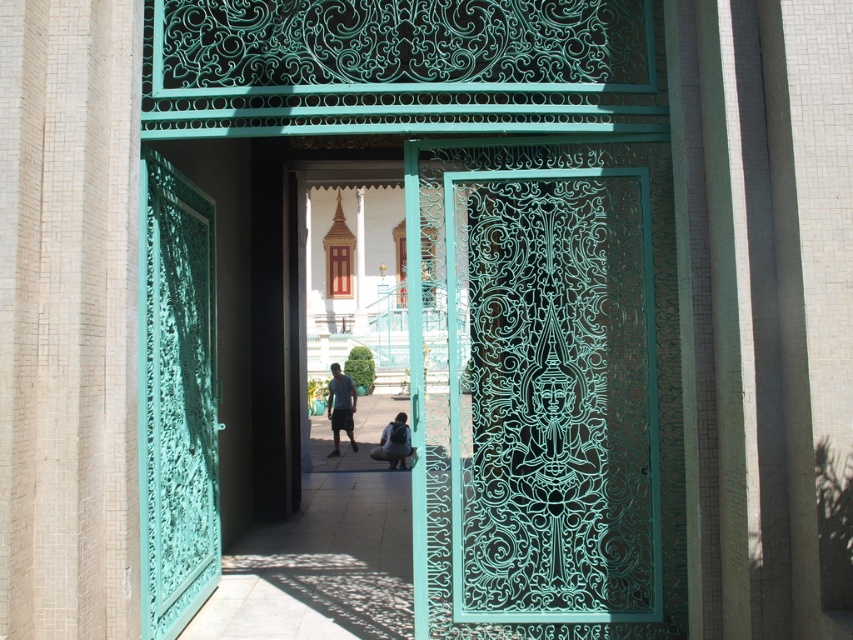
Who is shorter, green carved door at center or dark blue t-shirt at center?

dark blue t-shirt at center is shorter.

Which is below, green carved door at center or dark blue t-shirt at center?

Positioned lower is dark blue t-shirt at center.

You are a GUI agent. You are given a task and a screenshot of the screen. Output one action in this format:
    pyautogui.click(x=<x>, y=<y>)
    Task: Click on the green carved door at center
    
    Given the screenshot: What is the action you would take?
    pyautogui.click(x=538, y=388)

Image resolution: width=853 pixels, height=640 pixels. In order to click on green carved door at center in this screenshot , I will do `click(538, 388)`.

Between green carved door at center and matte black backpack at center, which one has more height?

green carved door at center

Does green carved door at center have a greater height compared to matte black backpack at center?

Correct, green carved door at center is much taller as matte black backpack at center.

Measure the distance between green carved door at center and camera.

They are 14.52 feet apart.

Find the location of a particular element. green carved door at center is located at coordinates (538, 388).

How far apart are dark blue t-shirt at center and matte black backpack at center?

2.64 meters

Which is more to the left, dark blue t-shirt at center or matte black backpack at center?

From the viewer's perspective, dark blue t-shirt at center appears more on the left side.

This screenshot has width=853, height=640. Describe the element at coordinates (340, 406) in the screenshot. I see `dark blue t-shirt at center` at that location.

This screenshot has height=640, width=853. I want to click on dark blue t-shirt at center, so click(x=340, y=406).